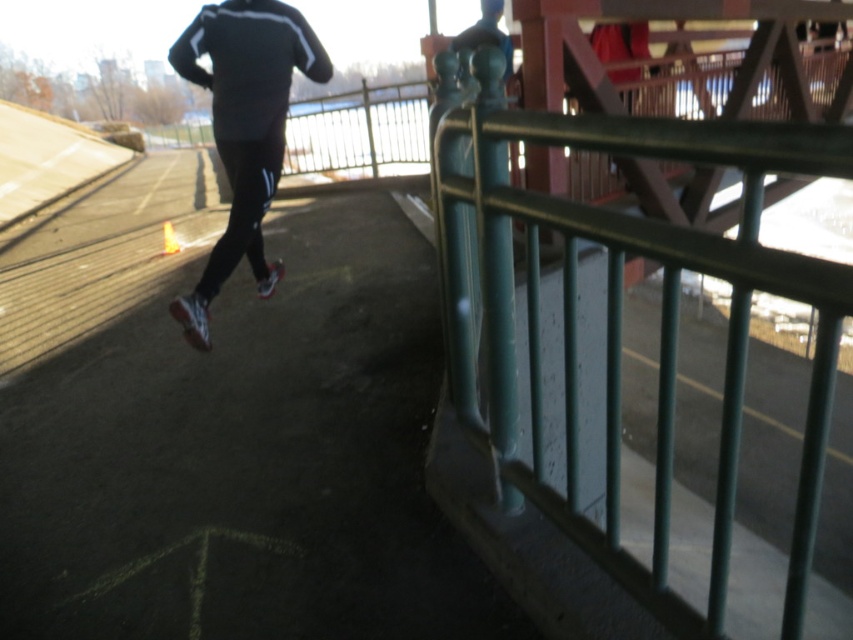
Question: Which of the following is the farthest from the observer?

Choices:
 (A) shiny red shoe at lower left
 (B) white mesh running shoe at center
 (C) green painted metal railing at center
 (D) matte black running suit at left

Answer: (B)

Question: Can you confirm if green painted metal railing at center is positioned below matte black running suit at left?

Choices:
 (A) yes
 (B) no

Answer: (A)

Question: Which object is positioned farthest from the green painted metal railing at center?

Choices:
 (A) shiny red shoe at lower left
 (B) matte black running suit at left
 (C) white mesh running shoe at center

Answer: (C)

Question: Can you confirm if matte black running suit at left is smaller than shiny red shoe at lower left?

Choices:
 (A) no
 (B) yes

Answer: (A)

Question: Among these objects, which one is nearest to the camera?

Choices:
 (A) shiny red shoe at lower left
 (B) green painted metal railing at center

Answer: (B)

Question: Where is shiny red shoe at lower left located in relation to white mesh running shoe at center in the image?

Choices:
 (A) below
 (B) above

Answer: (A)